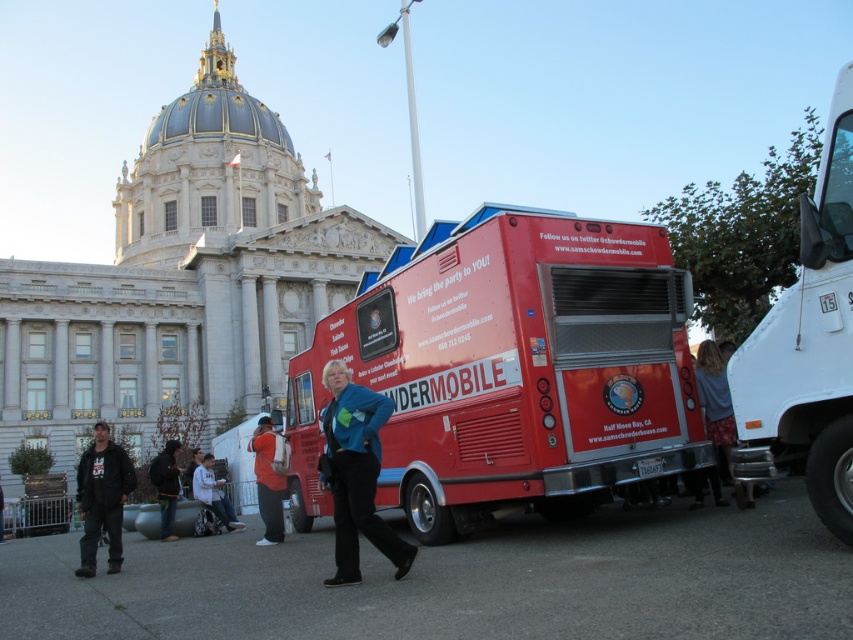
You are a photographer trying to capture a photo of the white glossy truck at right and the denim jacket at lower center in the same frame. Based on their sizes, which one will appear larger in the photo?

The white glossy truck at right will appear larger in the photo because it is much taller than the denim jacket at lower center.

You are a photographer trying to capture a photo of the orange cotton hoodie at center and dark blue jeans at lower left. Which object should you zoom in on to ensure both are clearly visible in the frame?

The orange cotton hoodie at center is larger in size than dark blue jeans at lower left, so you should zoom in on the orange cotton hoodie at center to ensure both are clearly visible in the frame.